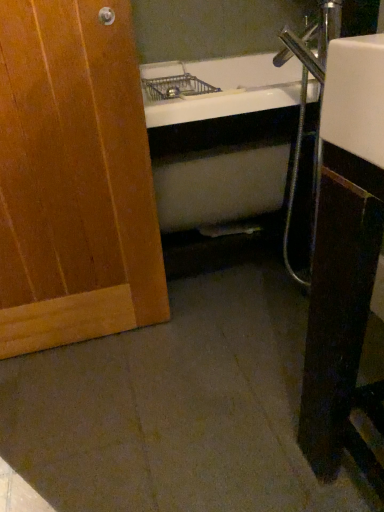
Where is `vacant area that lies in front of wooden door at left`? The width and height of the screenshot is (384, 512). vacant area that lies in front of wooden door at left is located at coordinates (95, 413).